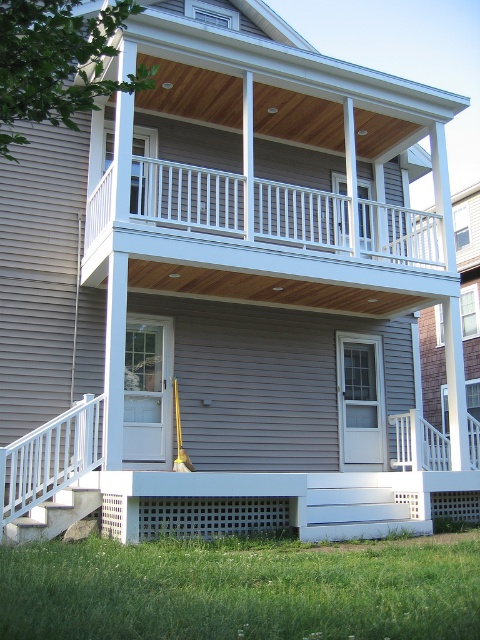
You are a delivery person holding a package that is 20 inches wide. You need to carry it through the space between the white matte railing at lower left and the white painted wood stairs at lower left. Will the package fit through the space?

The space between the white matte railing at lower left and the white painted wood stairs at lower left is 18.02 inches. Since the package is 20 inches wide, it is wider than the available space. The package will not fit through the space.

Consider the image. You are standing on the front porch of the house and want to walk down the stairs. Which object is closer to you as you face the stairs? The white matte railing at lower left or the white painted wood stairs at lower left?

The white painted wood stairs at lower left are closer to you since the white matte railing at lower left is positioned to the left of them, meaning the stairs are in front of the railing.

Please provide the exact 2D coordinates of the white matte railing at lower left in the image.

The white matte railing at lower left is located at coordinates 0.716 on the x axis and 0.104 on the y axis.